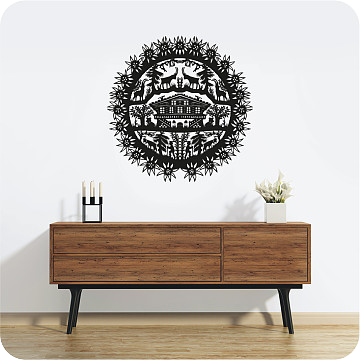
Identify the location of wall. The height and width of the screenshot is (360, 360). (129, 199).